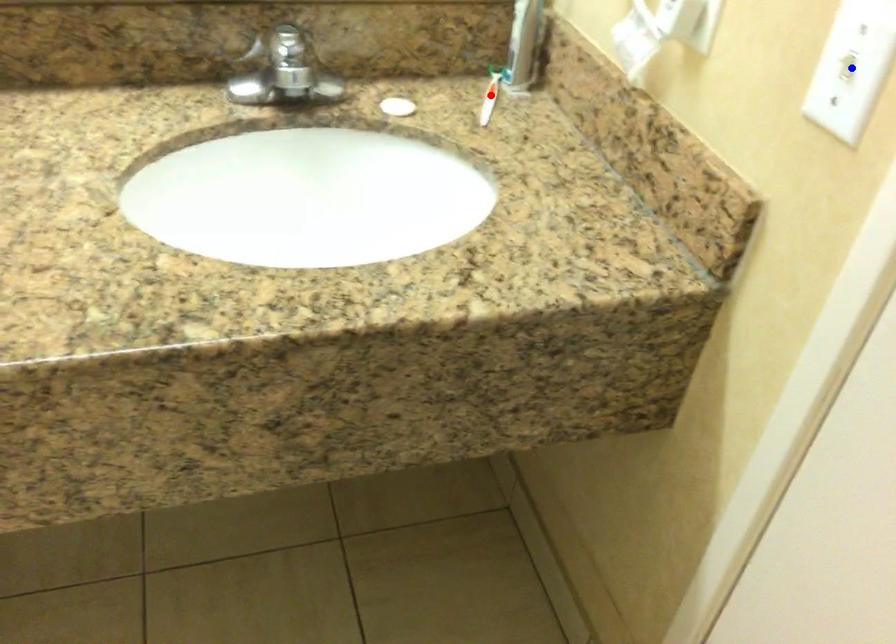
Question: Two points are marked on the image. Which point is closer to the camera?

Choices:
 (A) Blue point is closer.
 (B) Red point is closer.

Answer: (A)